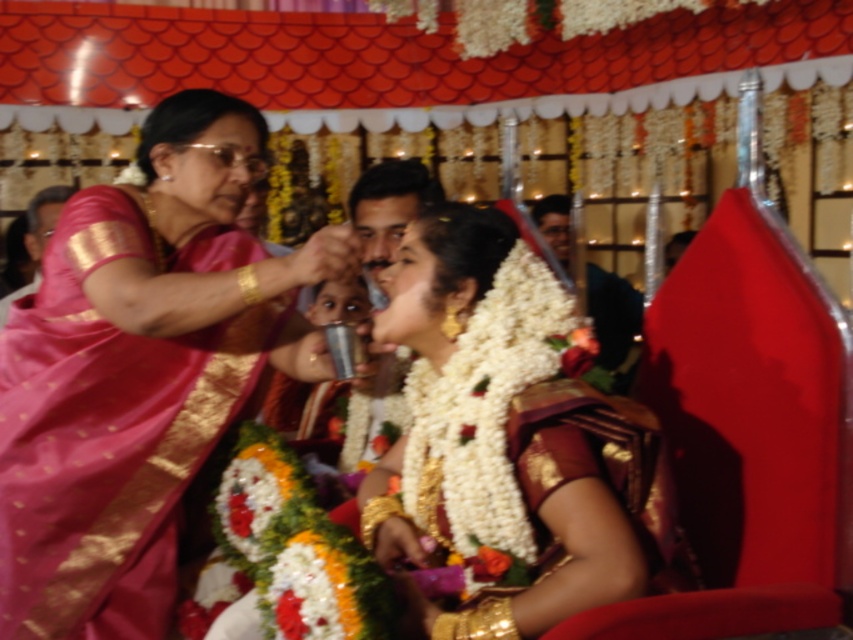
You are a guest at the wedding and want to take a photo of the bride. The photographer tells you that the pink silk saree at upper left and the dark green fabric at upper center are blocking your view. Which object should you move to the right to get a better view of the bride?

You should move the pink silk saree at upper left to the right since it is currently to the left of the dark green fabric at upper center, which means moving it right would clear the view.

You are a photographer at the wedding venue and need to position a camera 2 meters away from the pink silk saree at upper left. Can you place it near the dark green fabric at upper center without exceeding the 2 meter limit?

The distance between the pink silk saree at upper left and dark green fabric at upper center is 2.28 meters. Placing the camera near the dark green fabric would exceed the 2 meter limit, so it is not possible.